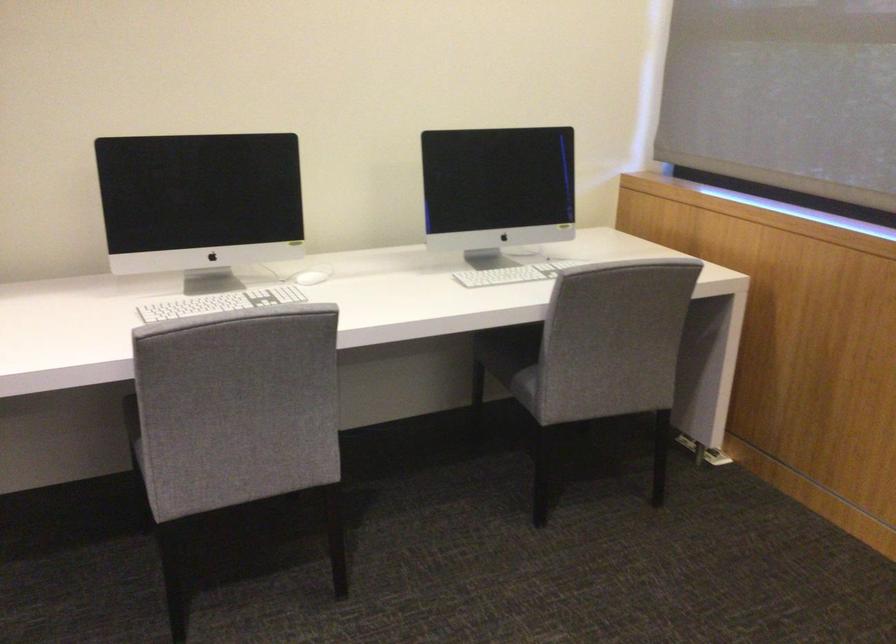
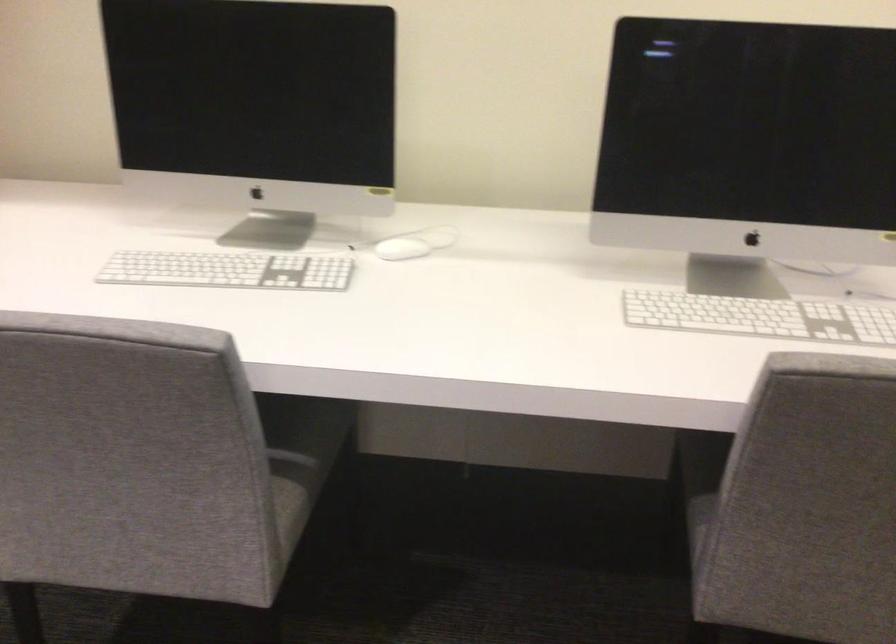
Question: Which direction would the cameraman need to move to produce the second image? Reply with the corresponding letter.

Choices:
 (A) Left
 (B) Right
 (C) Forward
 (D) Backward

Answer: (C)